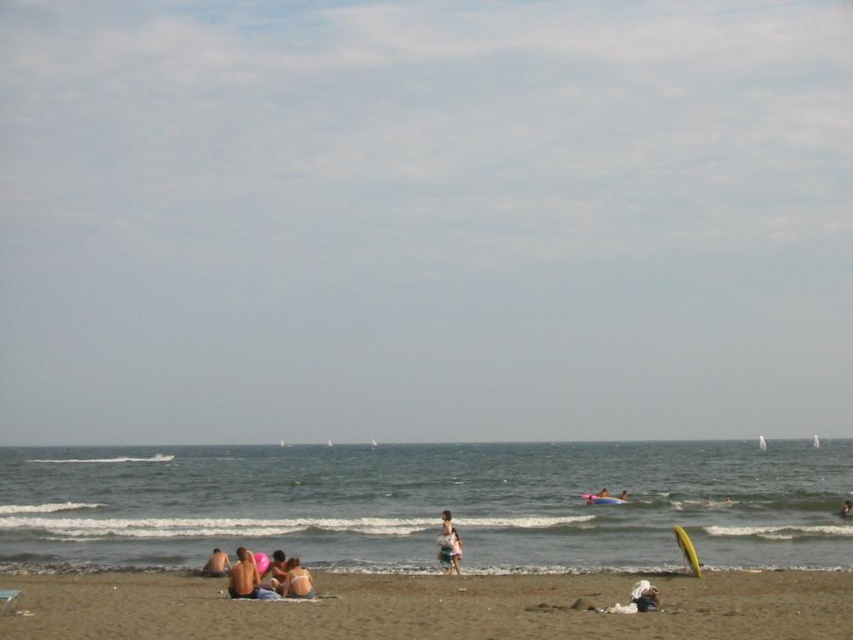
You are a photographer trying to capture a photo of the light pink fabric dress at center while avoiding the bright pink beach ball. Where should you position yourself to ensure the dress is in the frame without the beach ball?

To capture the light pink fabric dress at center without the bright pink beach ball, position yourself such that the dress is centered in your frame. Since the beach ball is near the group of people and the dress is at coordinates approximately 0.852 on the x and 0.526 on the y axis, adjusting your angle to focus on the dress while excluding the beach ball area would work.

You are a photographer standing on the beach and want to capture a photo that includes both the light pink fabric dress at center and the beige sand at lower left. Based on their positions, which object should you focus on first to ensure both are in the frame?

The light pink fabric dress at center is taller than the beige sand at lower left, so you should focus on the light pink fabric dress at center first to ensure both are in the frame.

In the scene shown: You are planning to take a photo of the transparent blue sky at upper center and the brown sandy beach at lower center. Which object will occupy more space in your photo?

The transparent blue sky at upper center will occupy more space in the photo because it is larger in size than the brown sandy beach at lower center.